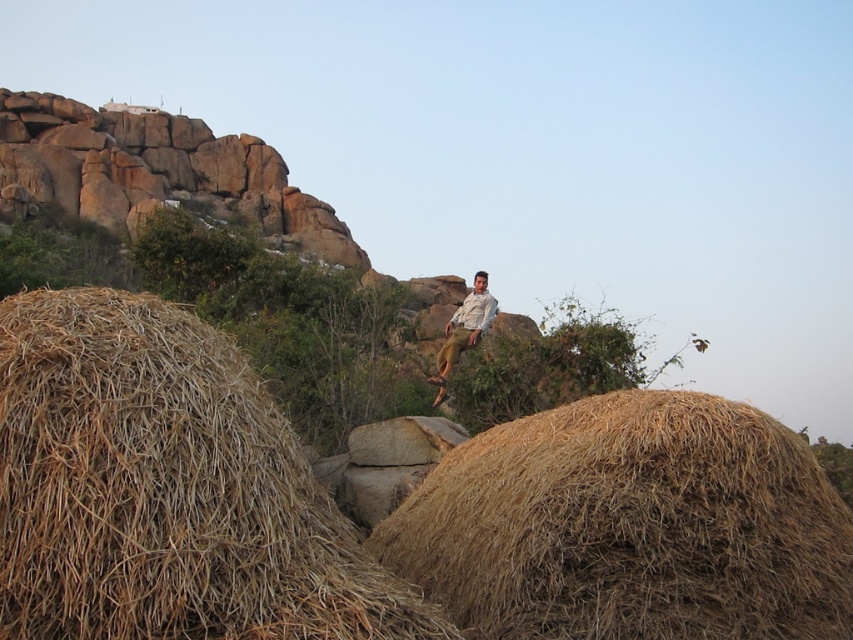
Consider the image. Does brown straw bale at center appear on the left side of light brown shirt at center?

Incorrect, brown straw bale at center is not on the left side of light brown shirt at center.

Does point (730, 580) come behind point (490, 308)?

No, (730, 580) is in front of (490, 308).

Find the location of a particular element. The height and width of the screenshot is (640, 853). brown straw bale at center is located at coordinates (630, 525).

Based on the photo, who is more forward, (x=195, y=621) or (x=610, y=397)?

Point (x=195, y=621) is in front.

What do you see at coordinates (166, 490) in the screenshot? Image resolution: width=853 pixels, height=640 pixels. I see `brown straw bale at lower left` at bounding box center [166, 490].

I want to click on brown straw bale at lower left, so click(x=166, y=490).

Does point (244, 634) come closer to viewer compared to point (486, 305)?

Yes, point (244, 634) is closer to viewer.

Which is more to the right, brown straw bale at lower left or light brown shirt at center?

light brown shirt at center

Locate an element on the screen. The height and width of the screenshot is (640, 853). brown straw bale at lower left is located at coordinates (166, 490).

You are a GUI agent. You are given a task and a screenshot of the screen. Output one action in this format:
    pyautogui.click(x=<x>, y=<y>)
    Task: Click on the brown straw bale at lower left
    
    Given the screenshot: What is the action you would take?
    pyautogui.click(x=166, y=490)